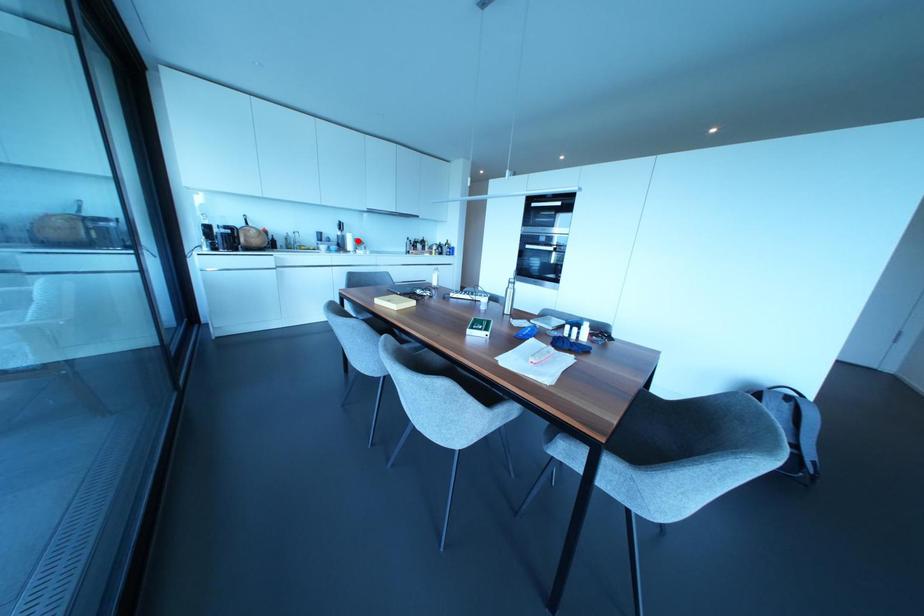
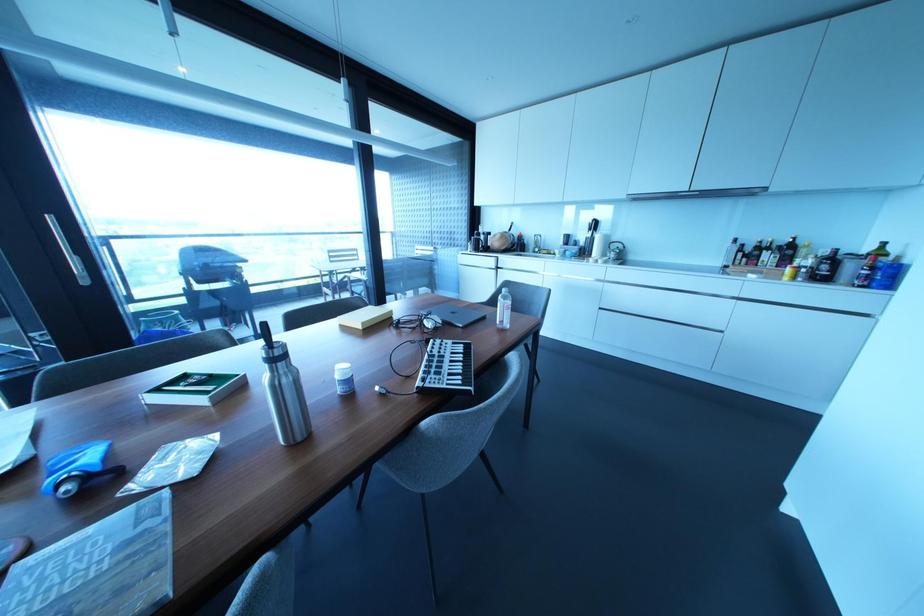
Where in the second image is the point corresponding to the highlighted location from the first image?

(614, 245)